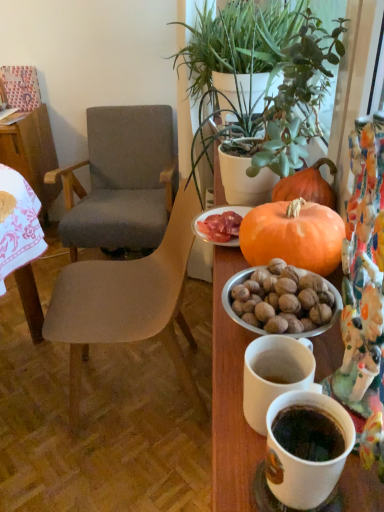
This screenshot has width=384, height=512. I want to click on free spot below textured gray fabric chair at left, which is counted as the 2th chair, starting from the back (from a real-world perspective), so click(141, 386).